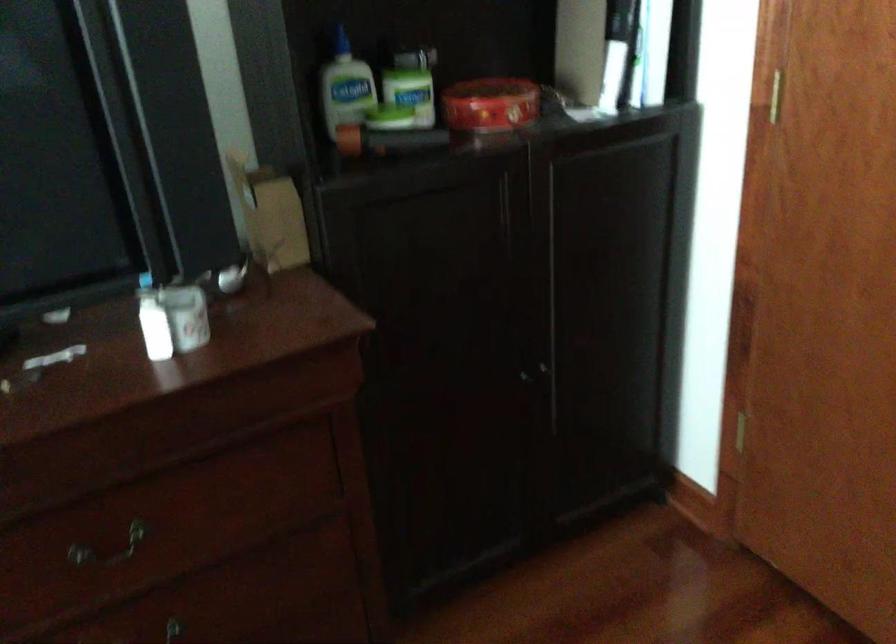
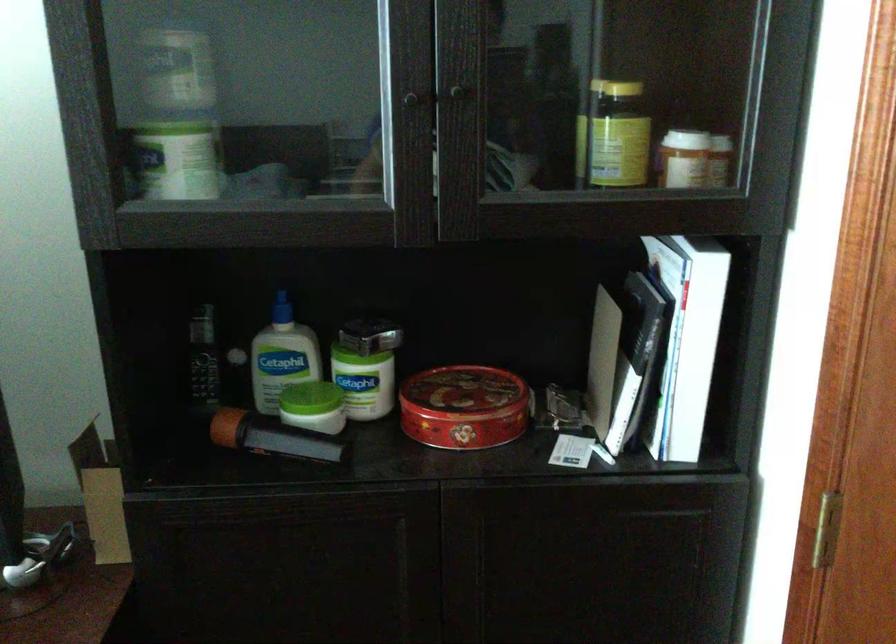
Locate, in the second image, the point that corresponds to (x=492, y=93) in the first image.

(462, 393)